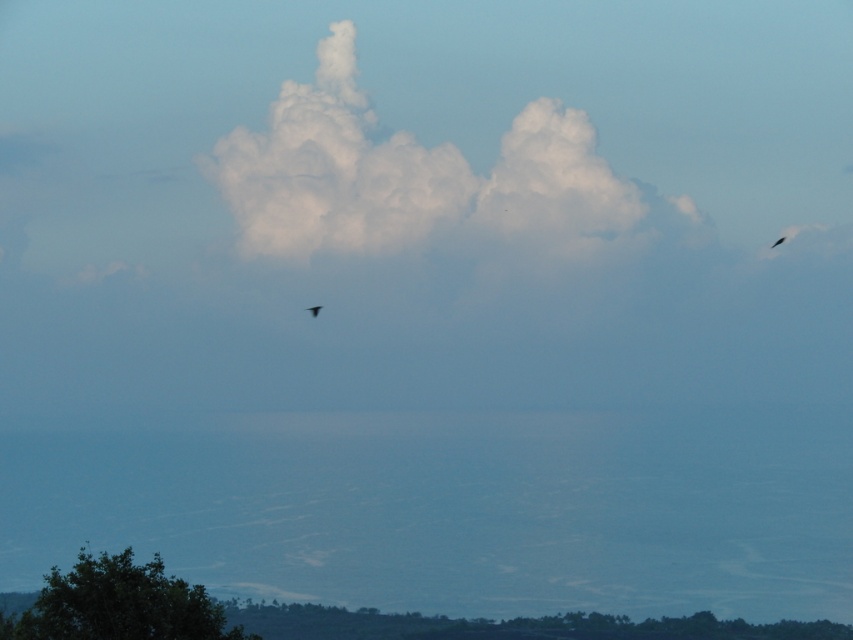
You are a photographer planning to capture the green leafy tree at lower left and the silvery metallic bird at center in a single frame. Based on their sizes in the image, which object will appear larger in your photo?

The green leafy tree at lower left is much taller than the silvery metallic bird at center, so it will appear larger in the photo.

You are a bird soaring in the sky and see a point at coordinates (x=419, y=180). Based on the scene, where is this point located?

The point at coordinates (x=419, y=180) is on the white fluffy cloud at center.